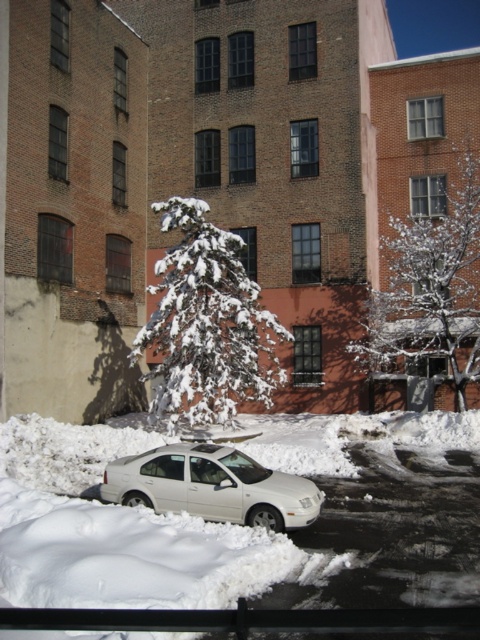
You are a delivery person needing to park your delivery van, which is 2 meters tall, in this snowy area. The white snowy tree at center and the white matte car at center are in the way. Can you safely park your van here without hitting the tree or the car?

The white snowy tree at center is taller than the white matte car at center. Since your van is 2 meters tall, and the tree is taller than the car, you need to ensure there is enough vertical clearance. However, without knowing the exact height of the tree, it is uncertain if the van can safely park here without hitting the tree. You should check the tree height before proceeding.

Looking at this image, you are a delivery person needing to place a package between the white fluffy snow at center and the white snowy tree at center. The package requires a minimum of 20 feet of space. Can you place it there?

The distance between the white fluffy snow at center and the white snowy tree at center is 23.39 feet, which is more than the required 20 feet. Therefore, you can place the package between them.